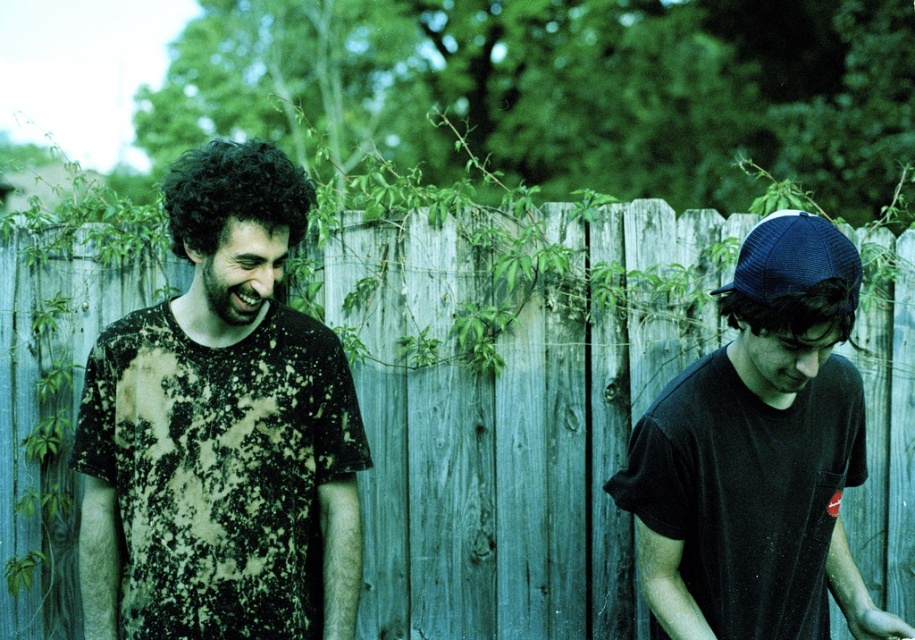
Question: Among these points, which one is farthest from the camera?

Choices:
 (A) (806, 216)
 (B) (576, 305)

Answer: (B)

Question: Estimate the real-world distances between objects in this image. Which object is farther from the black matte t-shirt at right?

Choices:
 (A) distressed black t-shirt at left
 (B) weathered wood fence at center

Answer: (B)

Question: Where is weathered wood fence at center located in relation to distressed black t-shirt at left in the image?

Choices:
 (A) right
 (B) left

Answer: (A)

Question: Is weathered wood fence at center to the left of black matte t-shirt at right from the viewer's perspective?

Choices:
 (A) no
 (B) yes

Answer: (B)

Question: Is weathered wood fence at center bigger than distressed black t-shirt at left?

Choices:
 (A) no
 (B) yes

Answer: (B)

Question: Among these points, which one is farthest from the camera?

Choices:
 (A) (525, 314)
 (B) (690, 442)

Answer: (A)